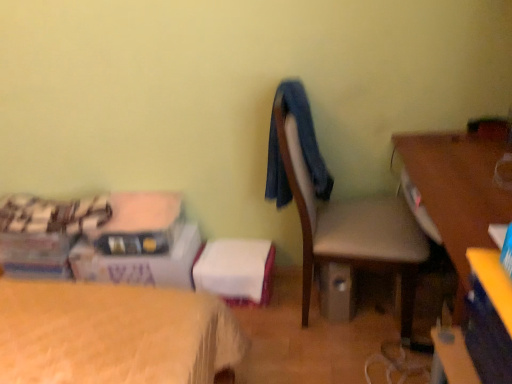
Question: Is blue fabric at center outside wooden desk at right?

Choices:
 (A) yes
 (B) no

Answer: (A)

Question: From a real-world perspective, is blue fabric at center located higher than wooden desk at right?

Choices:
 (A) no
 (B) yes

Answer: (B)

Question: Is blue fabric at center turned away from wooden desk at right?

Choices:
 (A) yes
 (B) no

Answer: (B)

Question: Does blue fabric at center have a smaller size compared to wooden desk at right?

Choices:
 (A) yes
 (B) no

Answer: (A)

Question: From the image's perspective, does blue fabric at center appear lower than wooden desk at right?

Choices:
 (A) no
 (B) yes

Answer: (A)

Question: Based on their sizes in the image, would you say white cardboard box at lower left is bigger or smaller than blue fabric at center?

Choices:
 (A) big
 (B) small

Answer: (A)

Question: Considering the relative positions of white cardboard box at lower left and blue fabric at center in the image provided, is white cardboard box at lower left to the left or to the right of blue fabric at center?

Choices:
 (A) right
 (B) left

Answer: (B)

Question: Looking at their shapes, would you say white cardboard box at lower left is wider or thinner than blue fabric at center?

Choices:
 (A) thin
 (B) wide

Answer: (B)

Question: Is white cardboard box at lower left inside or outside of blue fabric at center?

Choices:
 (A) inside
 (B) outside

Answer: (B)

Question: From the image's perspective, is matte gray chair at center positioned above or below wooden desk at right?

Choices:
 (A) above
 (B) below

Answer: (A)

Question: In the image, is matte gray chair at center on the left side or the right side of wooden desk at right?

Choices:
 (A) right
 (B) left

Answer: (B)

Question: Is point click(x=339, y=248) closer or farther from the camera than point click(x=450, y=248)?

Choices:
 (A) closer
 (B) farther

Answer: (B)

Question: Looking at their shapes, would you say matte gray chair at center is wider or thinner than wooden desk at right?

Choices:
 (A) thin
 (B) wide

Answer: (A)

Question: Is matte gray chair at center in front of or behind white cardboard box at lower left in the image?

Choices:
 (A) behind
 (B) front

Answer: (B)

Question: From the image's perspective, relative to white cardboard box at lower left, is matte gray chair at center above or below?

Choices:
 (A) above
 (B) below

Answer: (A)